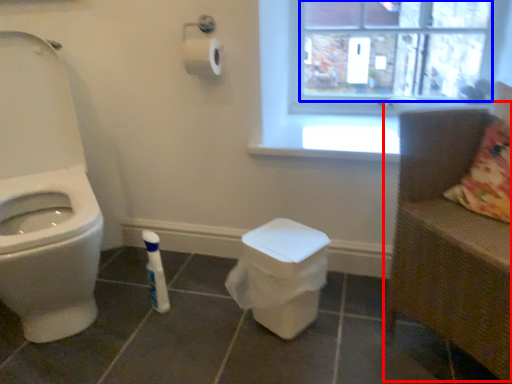
Question: Which point is further to the camera, armchair (highlighted by a red box) or window screen (highlighted by a blue box)?

Choices:
 (A) armchair
 (B) window screen

Answer: (B)